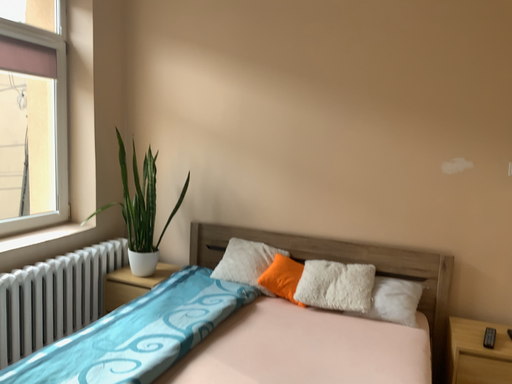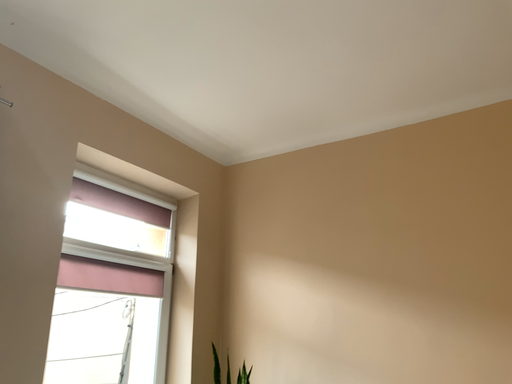
Question: Which way did the camera rotate in the video?

Choices:
 (A) rotated right
 (B) rotated left

Answer: (B)